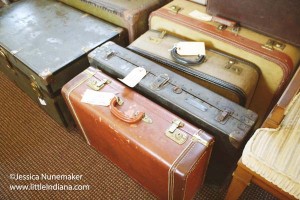
Locate an element on the screen. This screenshot has width=300, height=200. wooden table is located at coordinates (287, 96).